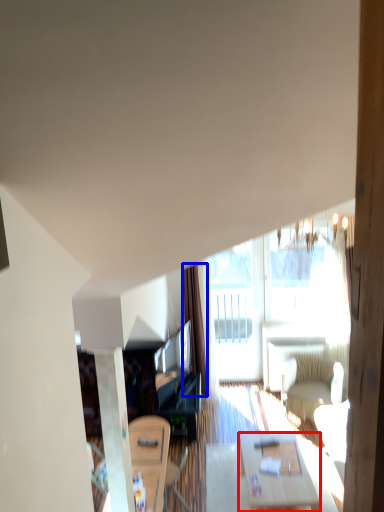
Question: Among these objects, which one is farthest to the camera, table (highlighted by a red box) or curtain (highlighted by a blue box)?

Choices:
 (A) table
 (B) curtain

Answer: (B)